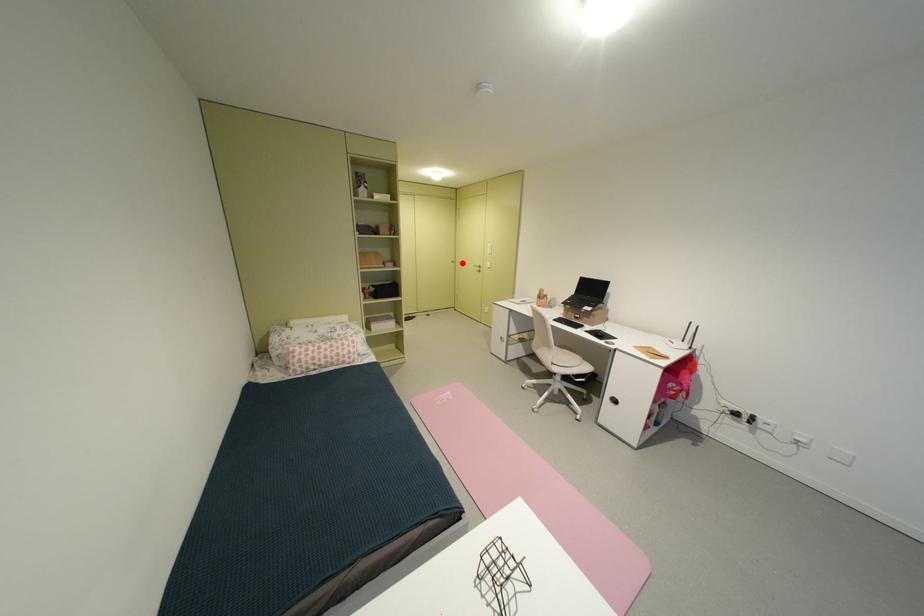
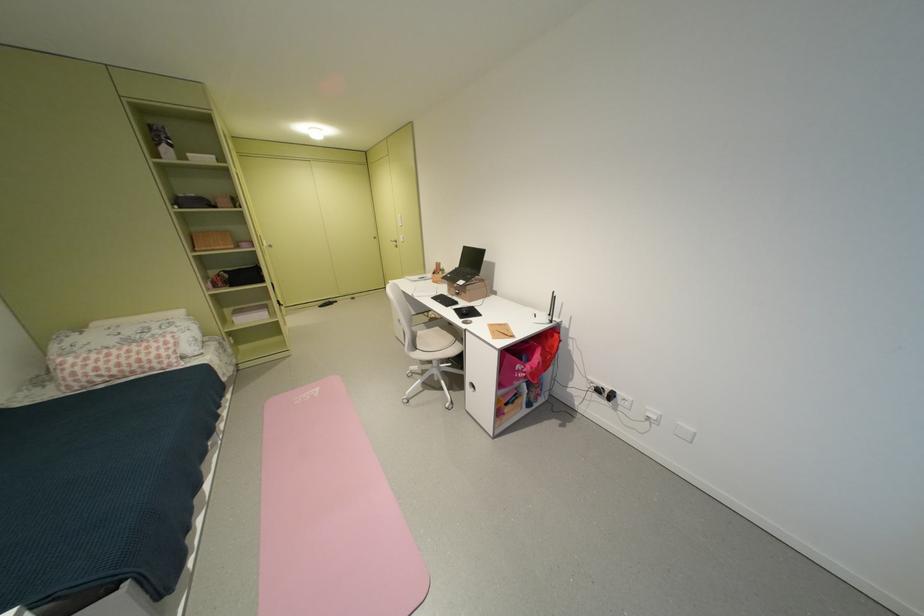
Locate, in the second image, the point that corresponds to the highlighted location in the first image.

(383, 238)